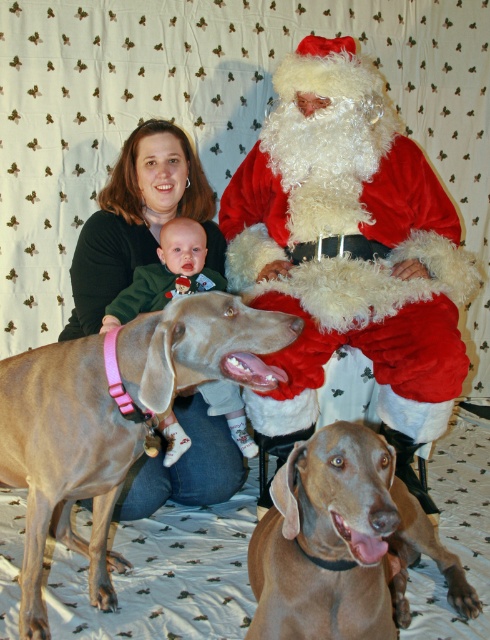
Question: In this image, where is smooth tan dog at center located relative to soft pink fabric baby at center?

Choices:
 (A) above
 (B) below

Answer: (B)

Question: Can you confirm if velvet santa claus at center is smaller than brown smooth coat at lower center?

Choices:
 (A) yes
 (B) no

Answer: (B)

Question: Which point is farther from the camera taking this photo?

Choices:
 (A) (336, 561)
 (B) (429, 397)
 (C) (145, 308)

Answer: (C)

Question: Among these points, which one is nearest to the camera?

Choices:
 (A) (72, 371)
 (B) (318, 90)
 (C) (341, 621)

Answer: (C)

Question: Which of the following is the closest to the observer?

Choices:
 (A) smooth tan dog at center
 (B) soft pink fabric baby at center

Answer: (A)

Question: Does brown smooth coat at lower center appear on the left side of soft pink fabric baby at center?

Choices:
 (A) no
 (B) yes

Answer: (A)